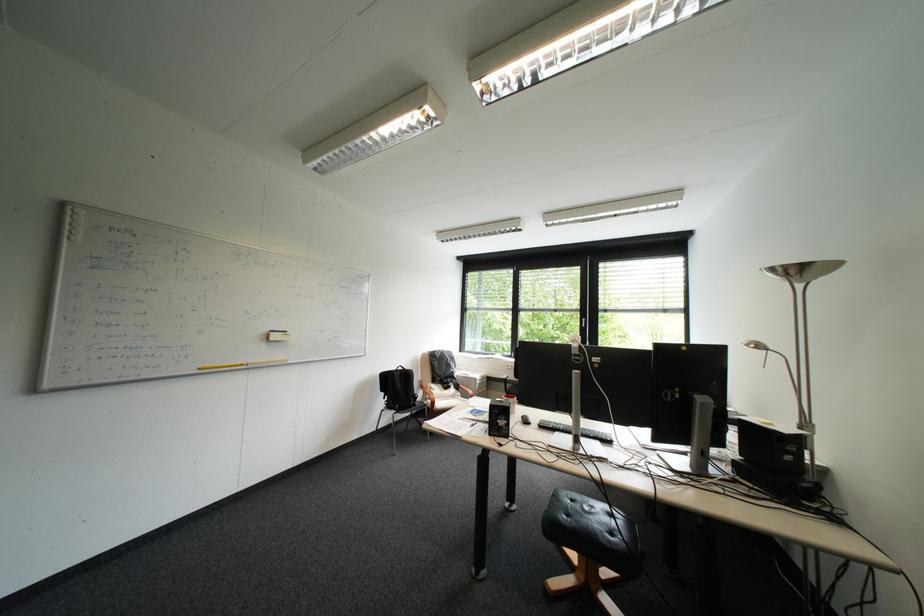
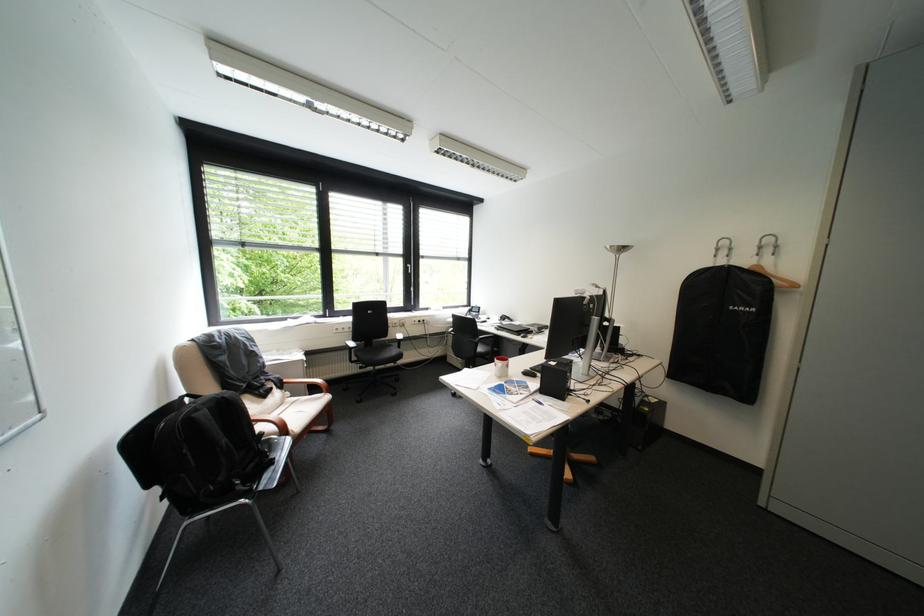
In the second image, find the point that corresponds to the point at 419,371 in the first image.

(236, 398)